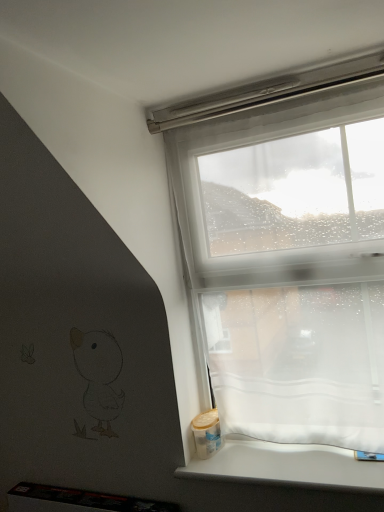
Locate an element on the screen. The width and height of the screenshot is (384, 512). free spot above white matte window sill at lower right (from a real-world perspective) is located at coordinates (274, 455).